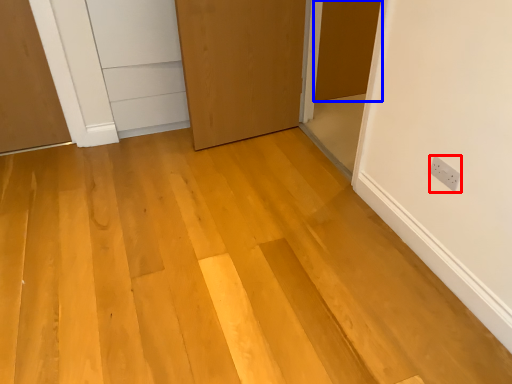
Question: Which of the following is the closest to the observer, electric outlet (highlighted by a red box) or door (highlighted by a blue box)?

Choices:
 (A) electric outlet
 (B) door

Answer: (A)